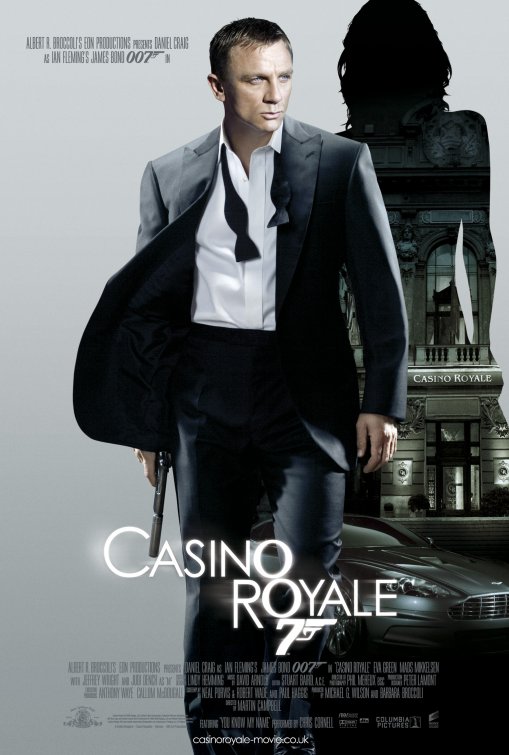
Locate an element on the screen. poster: casino royale is located at coordinates (84, 134).